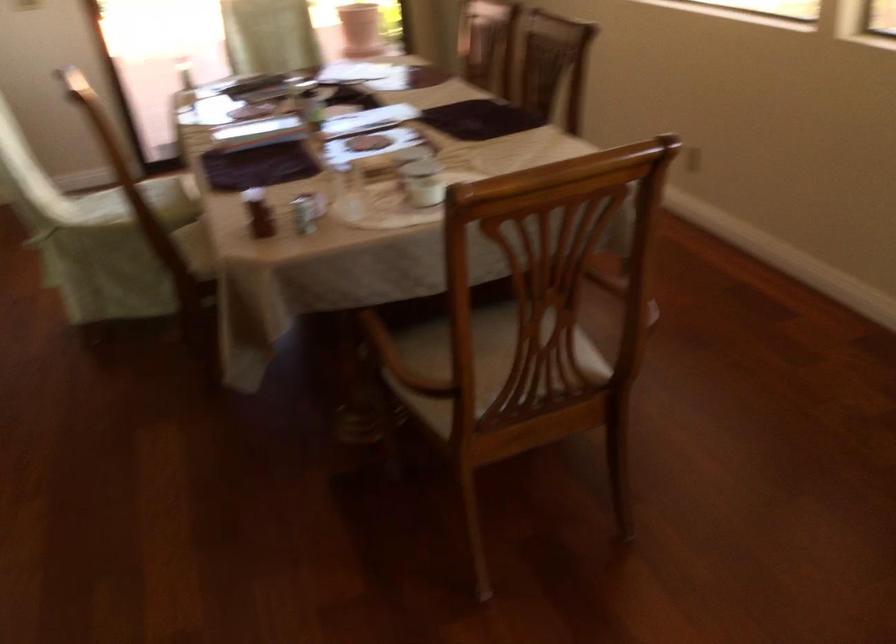
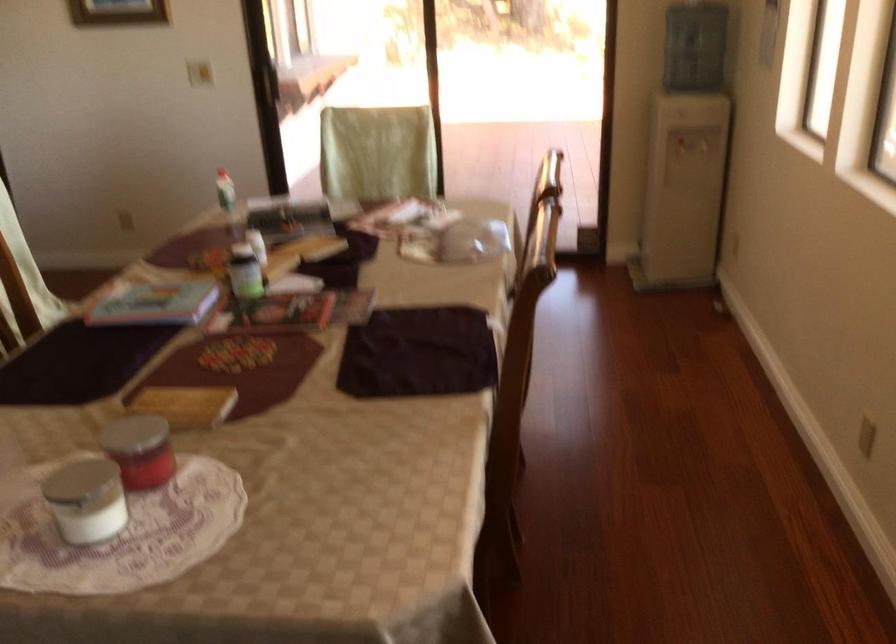
The point at (x=421, y=171) is marked in the first image. Where is the corresponding point in the second image?

(162, 465)